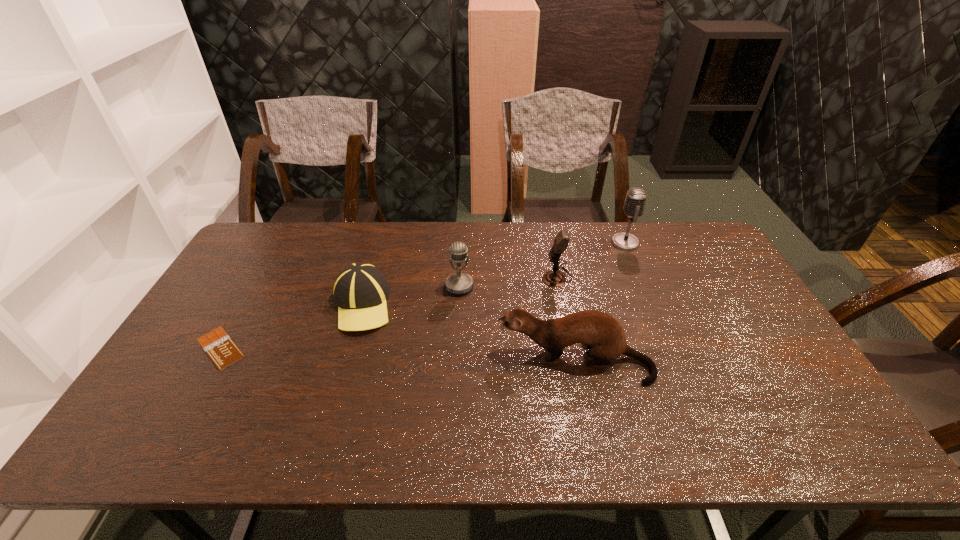
The image size is (960, 540). Identify the location of vacant space that's between the second microphone from left to right and the tallest object. (591, 260).

At what (x,y) coordinates should I click in order to perform the action: click on unoccupied area between the second microphone from left to right and the rightmost microphone. Please return your answer as a coordinate pair (x, y). Looking at the image, I should click on (591, 260).

Identify the location of the second closest object relative to the second object from left to right. The width and height of the screenshot is (960, 540). (222, 350).

Identify the location of the closest object to the second shortest object. (458, 283).

The height and width of the screenshot is (540, 960). Identify the location of microphone that stands as the closest to the baseball cap. (458, 283).

Locate an element on the screen. Image resolution: width=960 pixels, height=540 pixels. microphone that stands as the closest to the second microphone from right to left is located at coordinates (636, 198).

I want to click on free space that satisfies the following two spatial constraints: 1. on the front side of the rightmost microphone; 2. on the front-facing side of the second microphone from left to right, so click(639, 277).